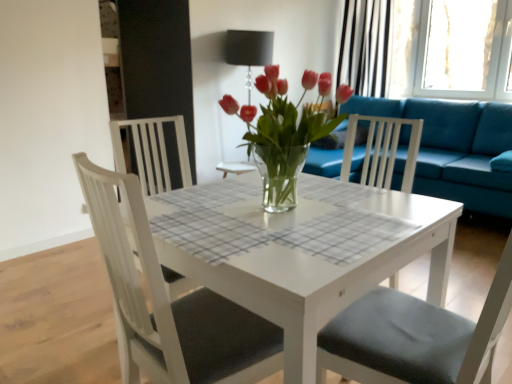
Question: From a real-world perspective, is white matte chair at center, which is the first chair from right to left, physically below white glossy table at center?

Choices:
 (A) no
 (B) yes

Answer: (A)

Question: Considering the relative positions of white matte chair at center, the second chair from the left, and white glossy table at center in the image provided, is white matte chair at center, the second chair from the left, to the right of white glossy table at center from the viewer's perspective?

Choices:
 (A) yes
 (B) no

Answer: (A)

Question: Can we say white matte chair at center, the second chair from the left, lies outside white glossy table at center?

Choices:
 (A) yes
 (B) no

Answer: (A)

Question: Does white matte chair at center, the second chair from the left, have a larger size compared to white glossy table at center?

Choices:
 (A) yes
 (B) no

Answer: (B)

Question: Is the depth of white matte chair at center, which is the first chair from right to left, less than that of white glossy table at center?

Choices:
 (A) yes
 (B) no

Answer: (A)

Question: Can you confirm if white matte chair at center, which is the first chair from right to left, is smaller than white glossy table at center?

Choices:
 (A) yes
 (B) no

Answer: (A)

Question: Can you confirm if teal fabric couch at right is positioned to the right of white matte chair at center, the 1th chair viewed from the left?

Choices:
 (A) yes
 (B) no

Answer: (A)

Question: Is teal fabric couch at right smaller than white matte chair at center, the 1th chair viewed from the left?

Choices:
 (A) no
 (B) yes

Answer: (A)

Question: Is white matte chair at center, the 2th chair when ordered from right to left, inside teal fabric couch at right?

Choices:
 (A) yes
 (B) no

Answer: (B)

Question: Would you consider teal fabric couch at right to be distant from white matte chair at center, the 1th chair viewed from the left?

Choices:
 (A) no
 (B) yes

Answer: (B)

Question: From a real-world perspective, is teal fabric couch at right under white matte chair at center, the 1th chair viewed from the left?

Choices:
 (A) no
 (B) yes

Answer: (B)

Question: Is teal fabric couch at right not within white matte chair at center, the 1th chair viewed from the left?

Choices:
 (A) yes
 (B) no

Answer: (A)

Question: Is white glossy table at center completely or partially inside black striped curtain at upper right?

Choices:
 (A) yes
 (B) no

Answer: (B)